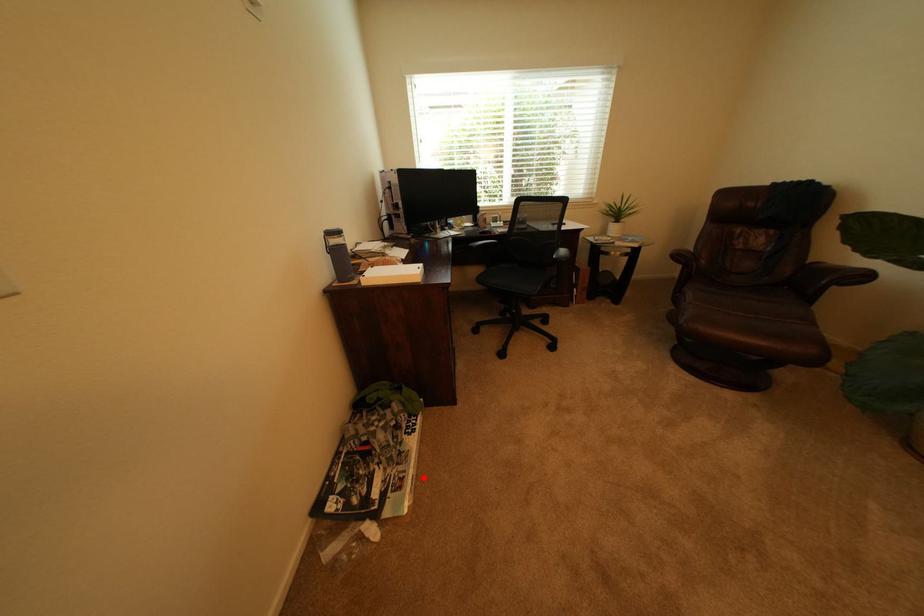
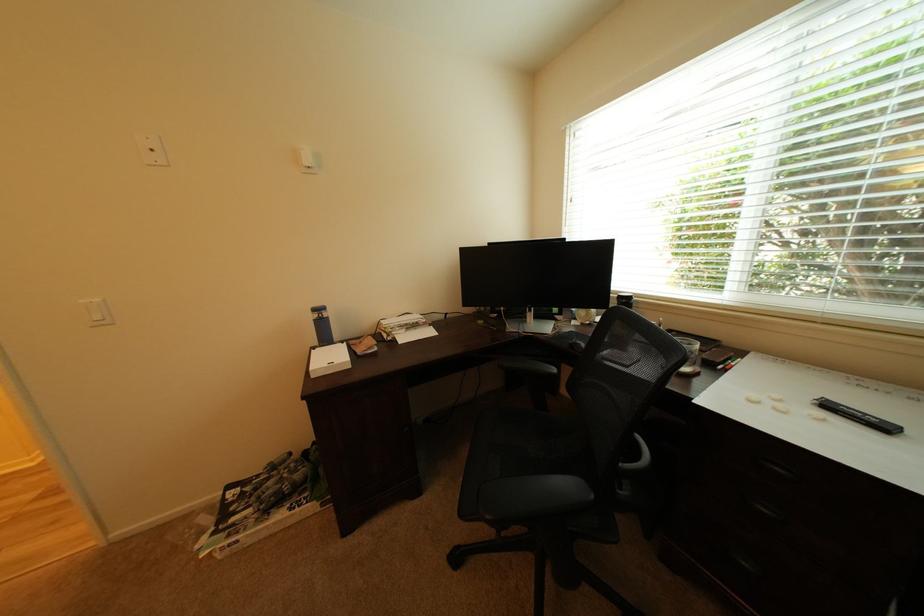
Find the pixel in the second image that matches the highlighted location in the first image.

(248, 543)